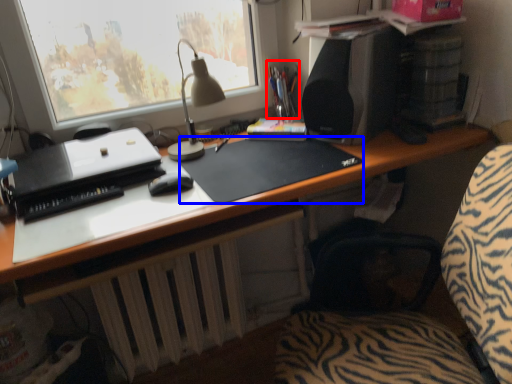
Question: Which object appears farthest to the camera in this image, stationery (highlighted by a red box) or mousepad (highlighted by a blue box)?

Choices:
 (A) stationery
 (B) mousepad

Answer: (A)